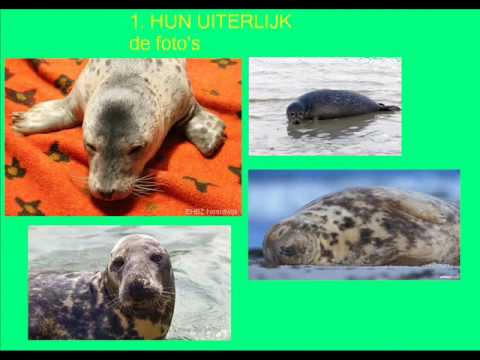
Where is `orange blanket`? The height and width of the screenshot is (360, 480). orange blanket is located at coordinates pos(198,167).